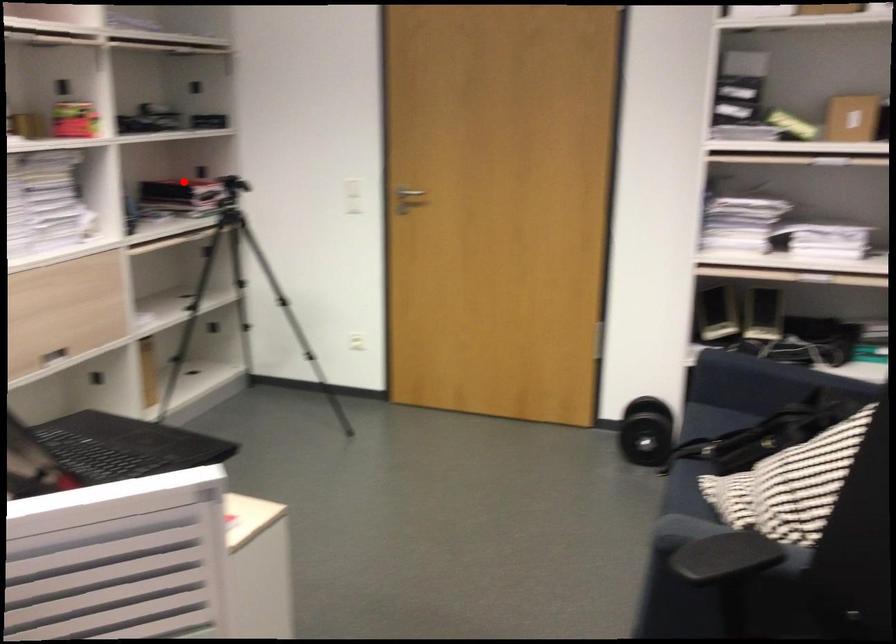
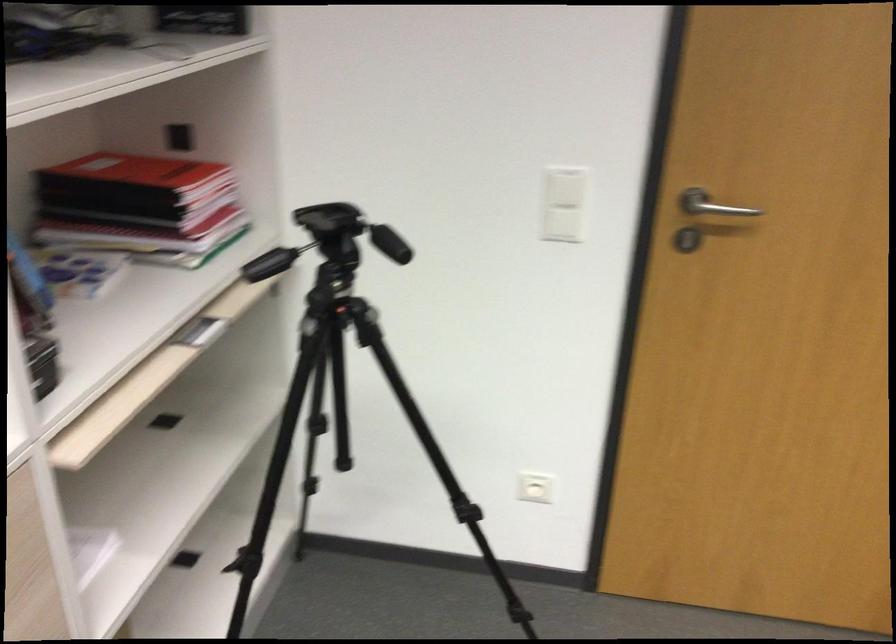
Question: A red point is marked in image1. In image2, is the corresponding 3D point closer to the camera or farther? Reply with the corresponding letter.

Choices:
 (A) The corresponding 3D point is closer.
 (B) The corresponding 3D point is farther.

Answer: (A)